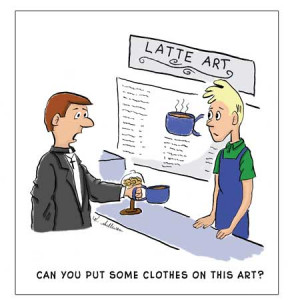
Identify the location of countertop. (162, 233).